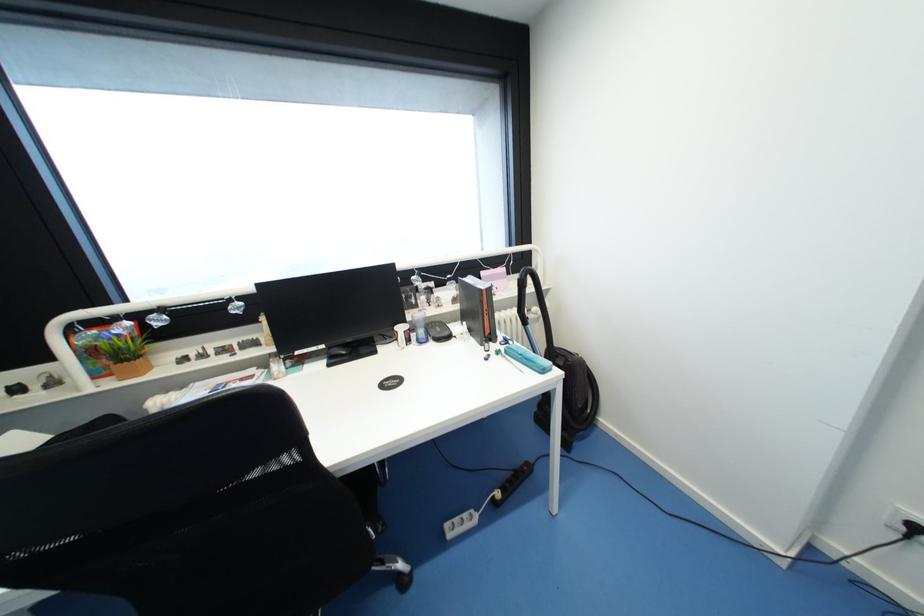
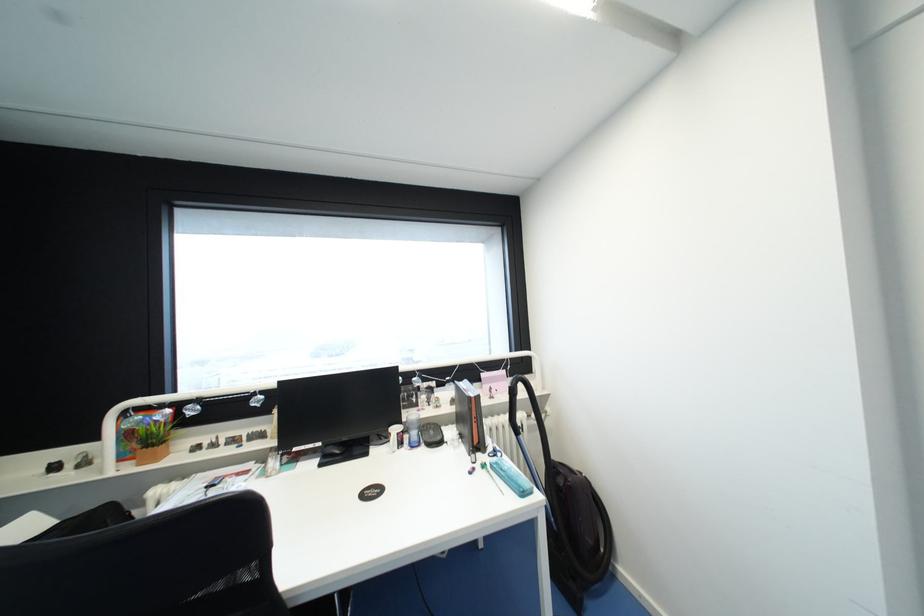
In the second image, find the point that corresponds to the point at 548,371 in the first image.

(528, 495)